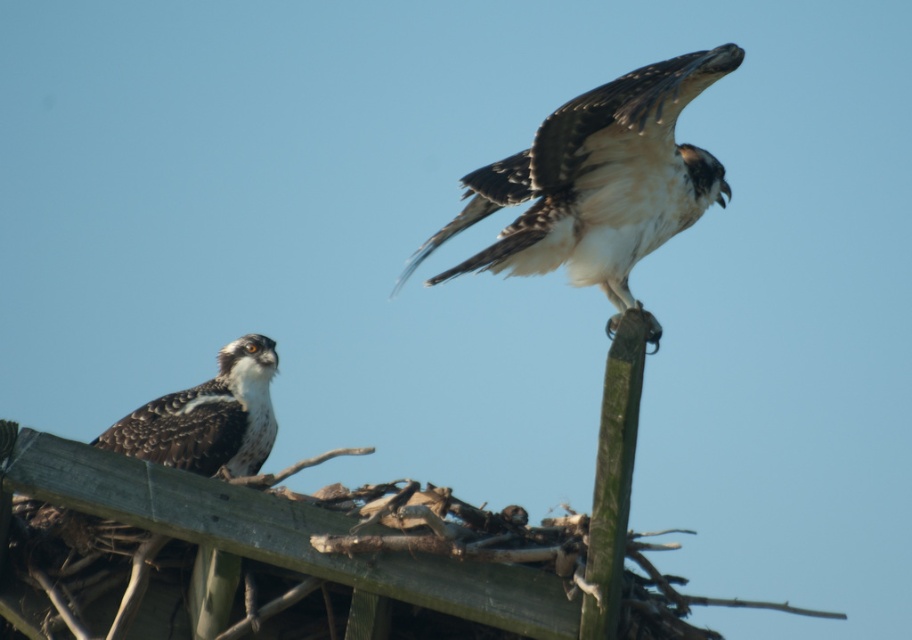
Question: Does white-brown feathers at upper right have a lesser width compared to dark brown speckled feathers at upper left?

Choices:
 (A) no
 (B) yes

Answer: (B)

Question: Which object appears closest to the camera in this image?

Choices:
 (A) white-brown feathers at upper right
 (B) dark brown speckled feathers at upper left

Answer: (B)

Question: Can you confirm if white-brown feathers at upper right is bigger than dark brown speckled feathers at upper left?

Choices:
 (A) no
 (B) yes

Answer: (A)

Question: Is white-brown feathers at upper right positioned before dark brown speckled feathers at upper left?

Choices:
 (A) yes
 (B) no

Answer: (B)